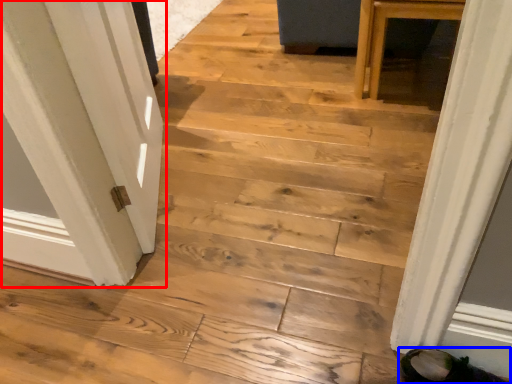
Question: Among these objects, which one is farthest to the camera, door (highlighted by a red box) or footwear (highlighted by a blue box)?

Choices:
 (A) door
 (B) footwear

Answer: (A)